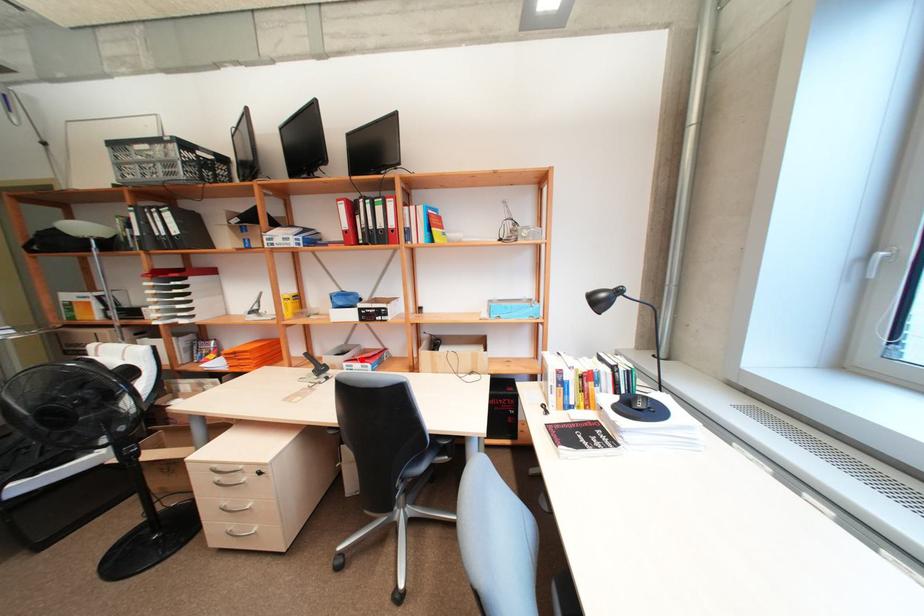
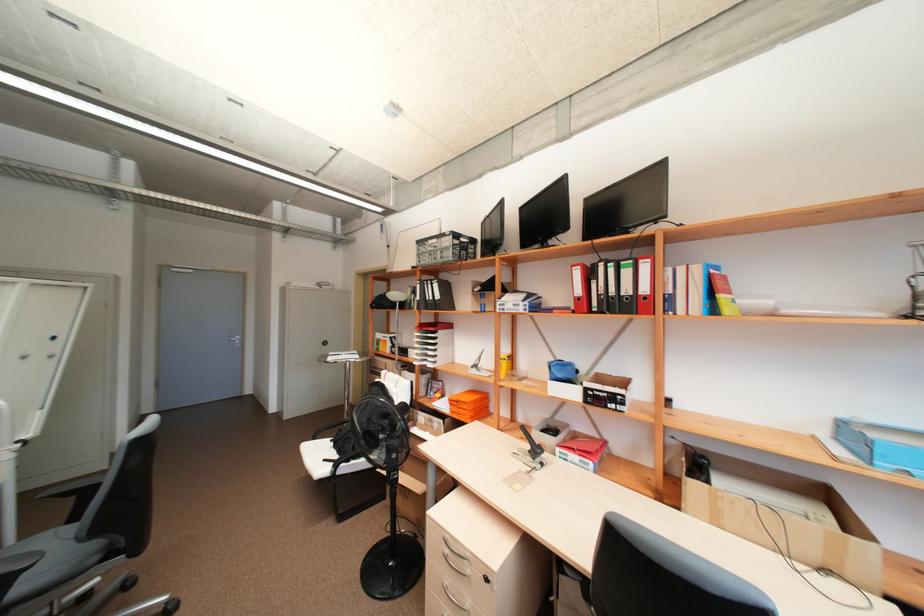
Find the pixel in the second image that matches the highlighted location in the first image.

(578, 448)